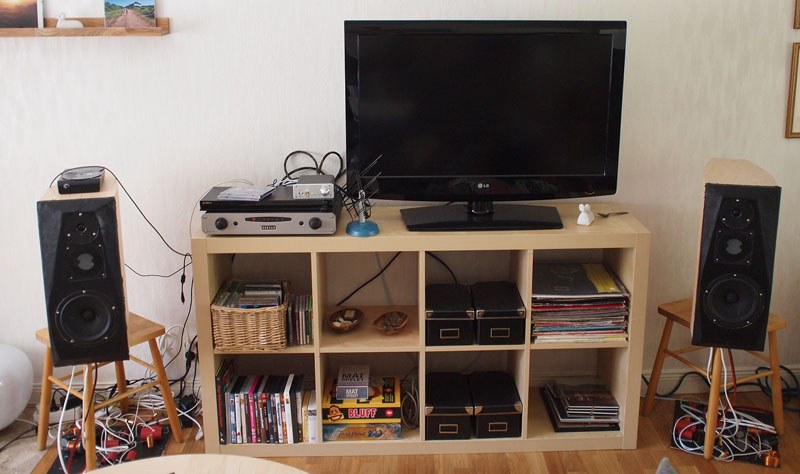
You are a GUI agent. You are given a task and a screenshot of the screen. Output one action in this format:
    pyautogui.click(x=<x>, y=<y>)
    Task: Click on the wires
    Image resolution: width=800 pixels, height=474 pixels.
    Given the screenshot: What is the action you would take?
    pyautogui.click(x=137, y=421), pyautogui.click(x=742, y=430), pyautogui.click(x=149, y=218), pyautogui.click(x=310, y=160)